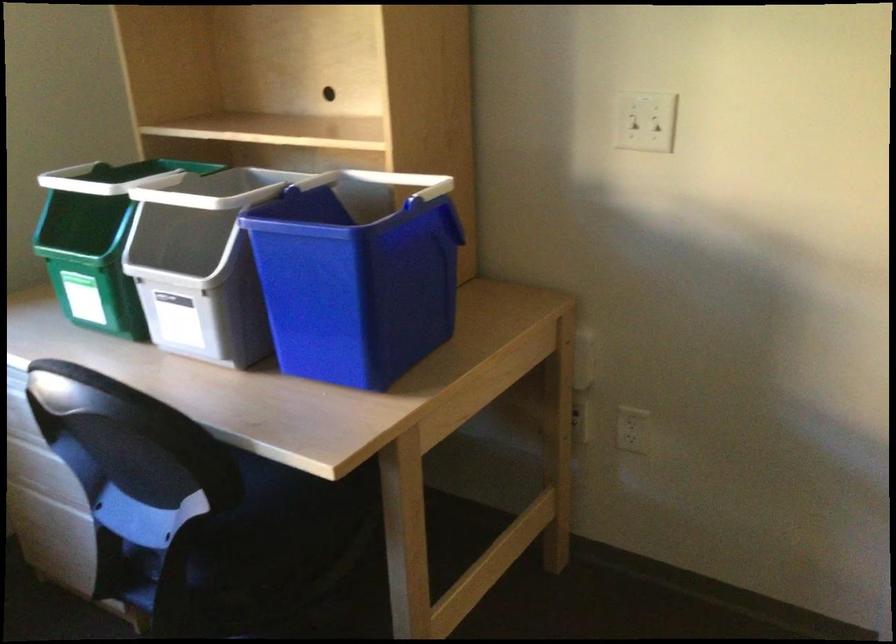
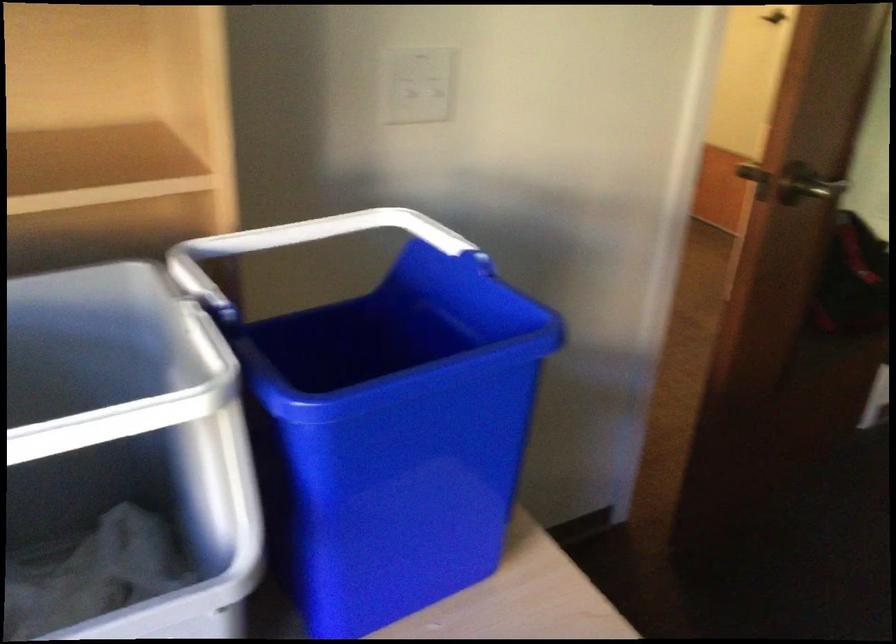
Where in the second image is the point corresponding to (359,178) from the first image?

(213, 257)